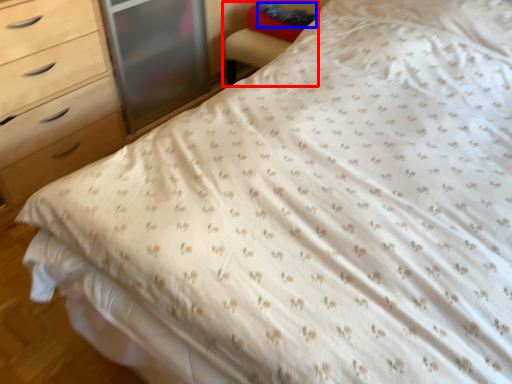
Question: Which object is closer to the camera taking this photo, armchair (highlighted by a red box) or pillow (highlighted by a blue box)?

Choices:
 (A) armchair
 (B) pillow

Answer: (A)